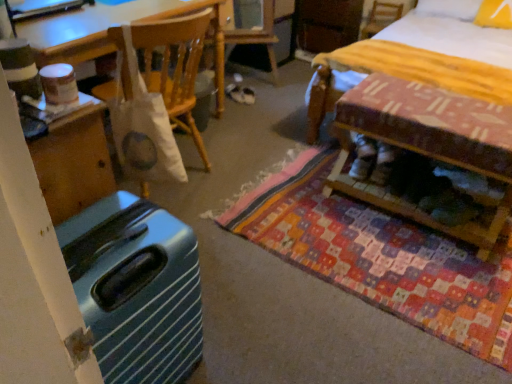
Where is `free space to the left of wooden bench at lower right`? The width and height of the screenshot is (512, 384). free space to the left of wooden bench at lower right is located at coordinates (308, 210).